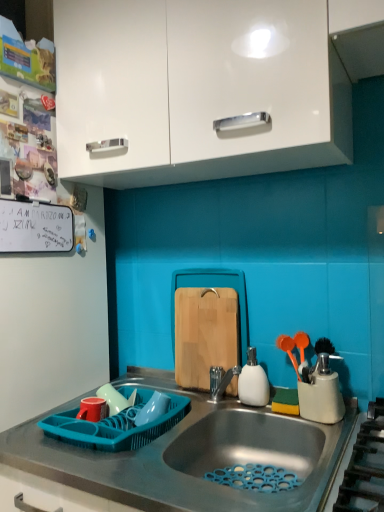
Question: From a real-world perspective, is white magnetic at left positioned over gray matte countertop at center based on gravity?

Choices:
 (A) yes
 (B) no

Answer: (A)

Question: Can you confirm if white magnetic at left is positioned to the left of gray matte countertop at center?

Choices:
 (A) no
 (B) yes

Answer: (B)

Question: Is white magnetic at left to the right of gray matte countertop at center from the viewer's perspective?

Choices:
 (A) yes
 (B) no

Answer: (B)

Question: Does white magnetic at left have a larger size compared to gray matte countertop at center?

Choices:
 (A) no
 (B) yes

Answer: (A)

Question: Would you consider white magnetic at left to be distant from gray matte countertop at center?

Choices:
 (A) no
 (B) yes

Answer: (A)

Question: Is white magnetic at left completely or partially outside of gray matte countertop at center?

Choices:
 (A) no
 (B) yes

Answer: (B)

Question: From a real-world perspective, does gray matte countertop at center stand above teal plastic dish rack at lower left, placed as the 2th appliance when sorted from right to left?

Choices:
 (A) no
 (B) yes

Answer: (A)

Question: Would you consider gray matte countertop at center to be distant from teal plastic dish rack at lower left, acting as the 1th appliance starting from the left?

Choices:
 (A) no
 (B) yes

Answer: (A)

Question: From the image's perspective, is gray matte countertop at center above teal plastic dish rack at lower left, placed as the 2th appliance when sorted from right to left?

Choices:
 (A) no
 (B) yes

Answer: (A)

Question: Is gray matte countertop at center thinner than teal plastic dish rack at lower left, placed as the 2th appliance when sorted from right to left?

Choices:
 (A) no
 (B) yes

Answer: (A)

Question: Does gray matte countertop at center have a smaller size compared to teal plastic dish rack at lower left, positioned as the 1th appliance in bottom-to-top order?

Choices:
 (A) yes
 (B) no

Answer: (B)

Question: Is gray matte countertop at center touching teal plastic dish rack at lower left, positioned as the 2th appliance in top-to-bottom order?

Choices:
 (A) yes
 (B) no

Answer: (B)

Question: Can you confirm if white glossy cabinet at upper center is shorter than gray matte countertop at center?

Choices:
 (A) no
 (B) yes

Answer: (A)